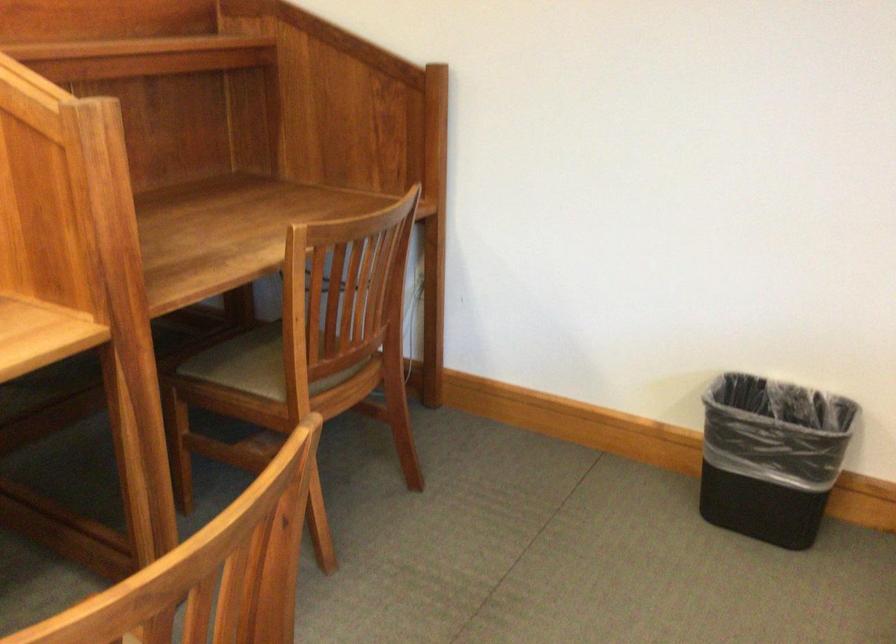
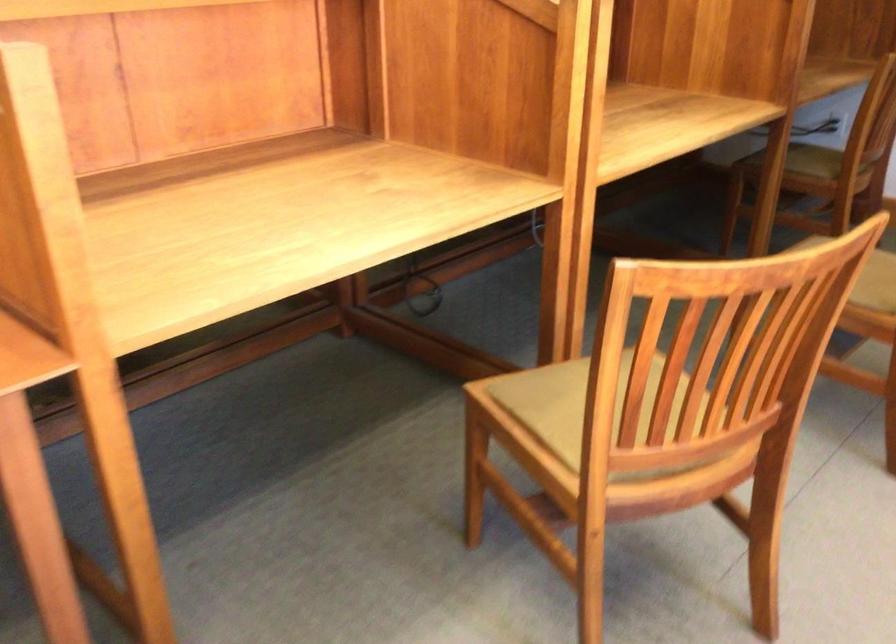
Find the pixel in the second image that matches point 221,404 in the first image.

(814, 161)